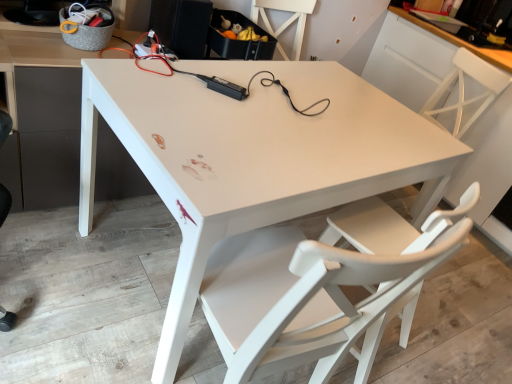
Question: Considering the relative positions of white matte chair at upper right, which is the 1th chair in right-to-left order, and white glossy table at center in the image provided, is white matte chair at upper right, which is the 1th chair in right-to-left order, to the left of white glossy table at center from the viewer's perspective?

Choices:
 (A) no
 (B) yes

Answer: (A)

Question: Is white matte chair at upper right, marked as the 1th chair in a back-to-front arrangement, behind white glossy table at center?

Choices:
 (A) yes
 (B) no

Answer: (A)

Question: Does white matte chair at upper right, which is the 1th chair in right-to-left order, have a lesser height compared to white glossy table at center?

Choices:
 (A) yes
 (B) no

Answer: (B)

Question: Does white matte chair at upper right, which is the 1th chair in right-to-left order, have a lesser width compared to white glossy table at center?

Choices:
 (A) yes
 (B) no

Answer: (A)

Question: From the image's perspective, would you say white matte chair at upper right, marked as the 2th chair in a left-to-right arrangement, is positioned over white glossy table at center?

Choices:
 (A) no
 (B) yes

Answer: (B)

Question: Is white matte chair at upper right, marked as the 1th chair in a back-to-front arrangement, directly adjacent to white glossy table at center?

Choices:
 (A) yes
 (B) no

Answer: (B)

Question: Is the depth of white matte chair at lower right, which is the first chair in left-to-right order, greater than that of white glossy table at center?

Choices:
 (A) yes
 (B) no

Answer: (A)

Question: Does white matte chair at lower right, the 2th chair viewed from the right, appear on the left side of white glossy table at center?

Choices:
 (A) yes
 (B) no

Answer: (B)

Question: Is white matte chair at lower right, the 1th chair when ordered from front to back, shorter than white glossy table at center?

Choices:
 (A) no
 (B) yes

Answer: (A)

Question: Could you tell me if white matte chair at lower right, the 2th chair viewed from the right, is facing white glossy table at center?

Choices:
 (A) no
 (B) yes

Answer: (B)

Question: Is white matte chair at lower right, which ranks as the second chair in back-to-front order, facing away from white glossy table at center?

Choices:
 (A) no
 (B) yes

Answer: (A)

Question: Is white glossy table at center a part of white matte chair at lower right, the 2th chair viewed from the right?

Choices:
 (A) yes
 (B) no

Answer: (B)

Question: Is white glossy table at center located outside white matte chair at upper right, marked as the 2th chair in a left-to-right arrangement?

Choices:
 (A) no
 (B) yes

Answer: (B)